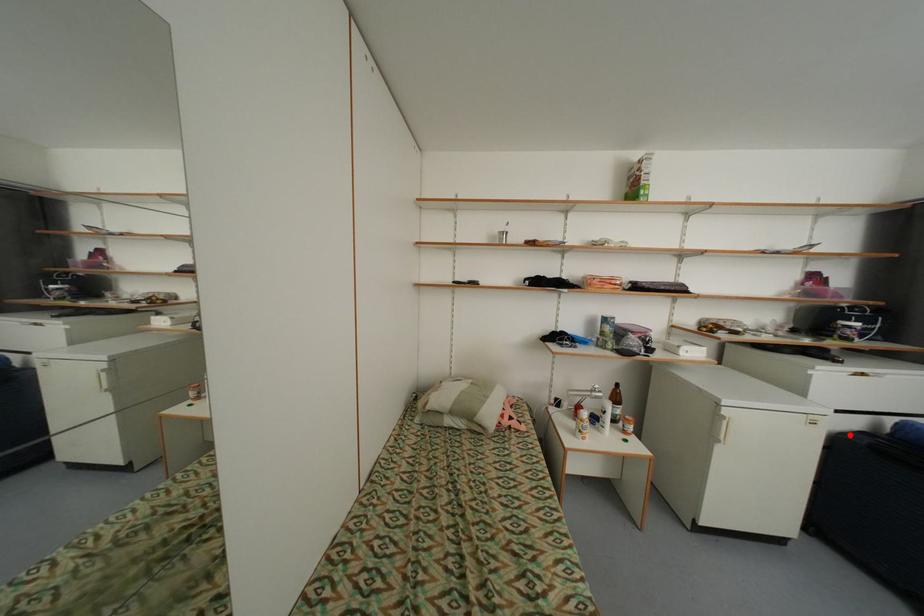
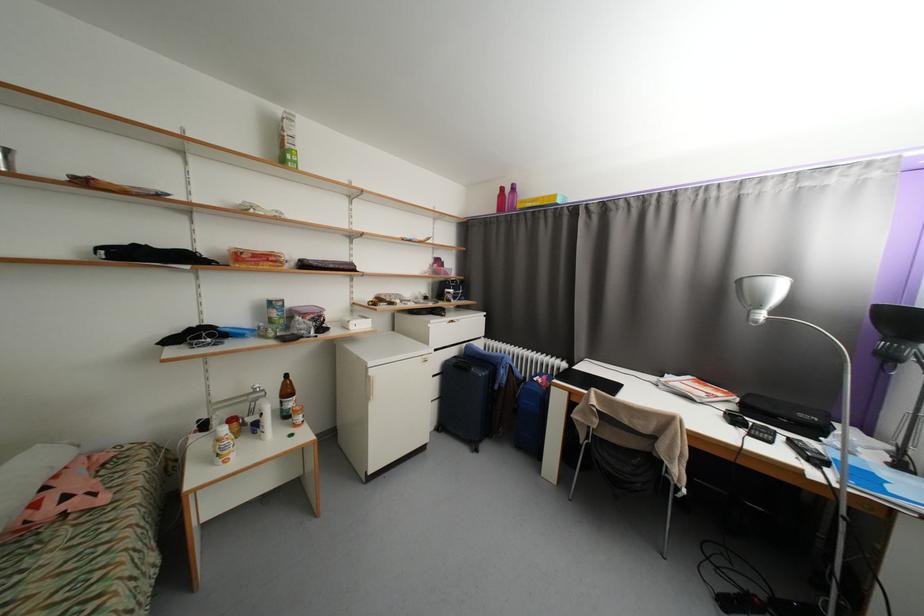
Find the pixel in the second image that matches the highlighted location in the first image.

(453, 362)